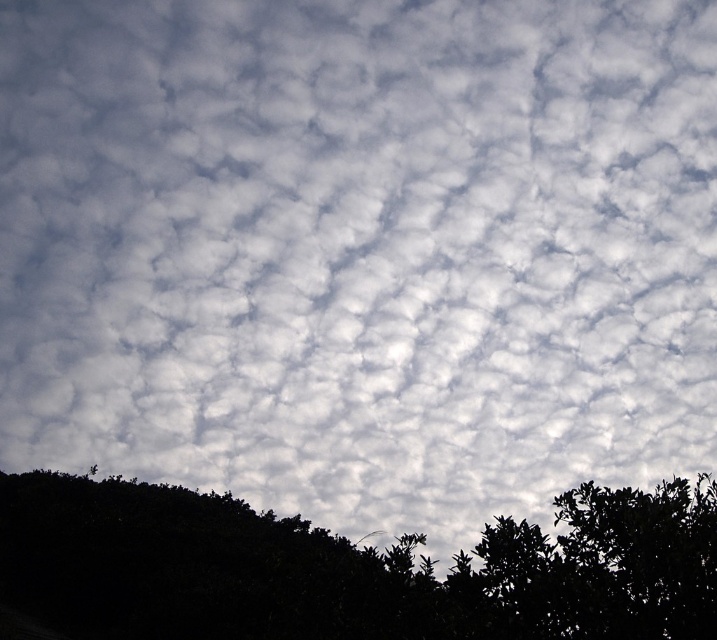
Measure the distance from dark green foliage at lower left to green leafy tree at lower right.

dark green foliage at lower left and green leafy tree at lower right are 4.02 meters apart.

Between dark green foliage at lower left and green leafy tree at lower right, which one is positioned higher?

green leafy tree at lower right is above.

The height and width of the screenshot is (640, 717). I want to click on dark green foliage at lower left, so click(191, 566).